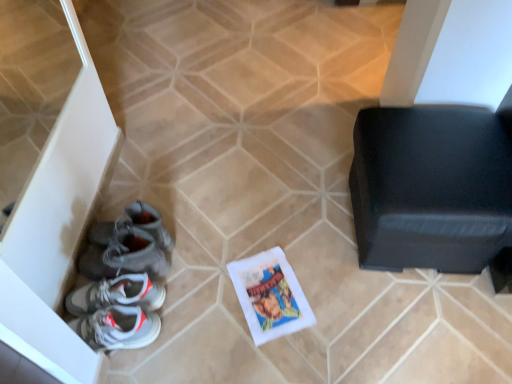
Question: Which is correct: gray suede sneakers at lower left is inside white paper comic book at center, or outside of it?

Choices:
 (A) inside
 (B) outside

Answer: (B)

Question: From their relative heights in the image, would you say gray suede sneakers at lower left is taller or shorter than white paper comic book at center?

Choices:
 (A) short
 (B) tall

Answer: (B)

Question: Estimate the real-world distances between objects in this image. Which object is closer to the gray suede sneakers at lower left?

Choices:
 (A) black leather ottoman at right
 (B) white paper comic book at center

Answer: (B)

Question: Estimate the real-world distances between objects in this image. Which object is closer to the white paper comic book at center?

Choices:
 (A) gray suede sneakers at lower left
 (B) black leather ottoman at right

Answer: (A)